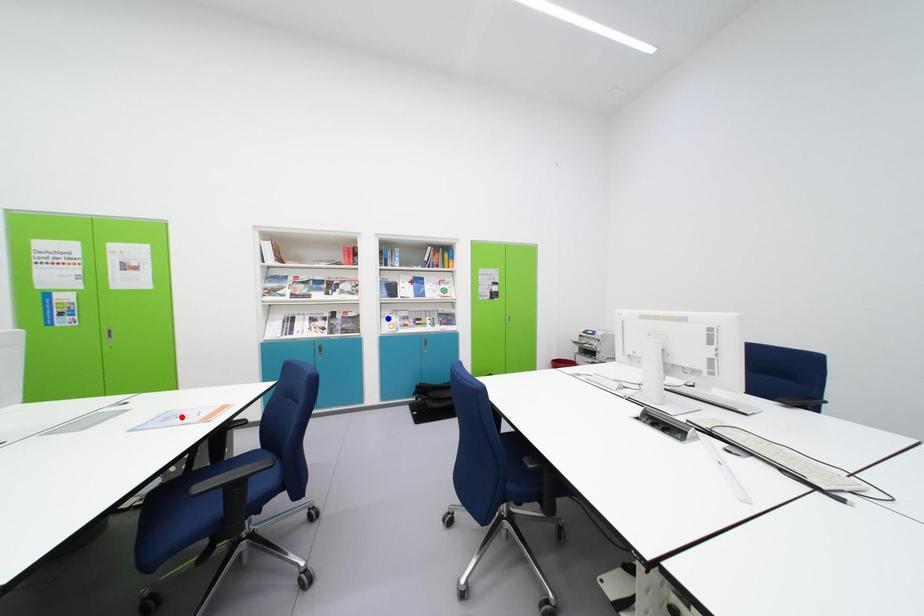
Question: Which of the two points in the image is closer to the camera?

Choices:
 (A) Blue point is closer.
 (B) Red point is closer.

Answer: (B)